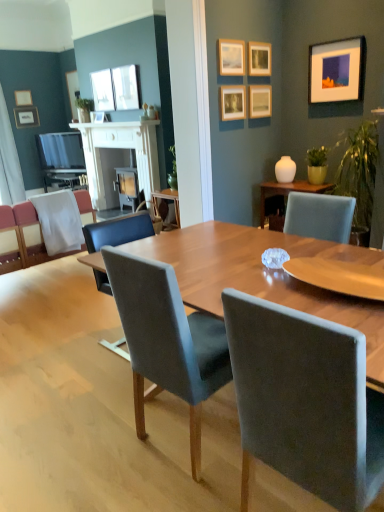
Question: From the image's perspective, is matte white picture frame at upper left, which ranks as the ninth picture frame in front-to-back order, located beneath matte silver picture frame at upper left, which is the 10th picture frame in front-to-back order?

Choices:
 (A) no
 (B) yes

Answer: (A)

Question: Is matte white picture frame at upper left, which is the 3th picture frame from left to right, positioned with its back to matte silver picture frame at upper left, the 2th picture frame in the left-to-right sequence?

Choices:
 (A) yes
 (B) no

Answer: (B)

Question: Is matte white picture frame at upper left, which ranks as the ninth picture frame in front-to-back order, touching matte silver picture frame at upper left, the first picture frame in the back-to-front sequence?

Choices:
 (A) no
 (B) yes

Answer: (A)

Question: Would you consider matte white picture frame at upper left, which is the 3th picture frame from left to right, to be distant from matte silver picture frame at upper left, placed as the ninth picture frame when sorted from right to left?

Choices:
 (A) no
 (B) yes

Answer: (A)

Question: Does matte white picture frame at upper left, which ranks as the ninth picture frame in front-to-back order, appear on the right side of matte silver picture frame at upper left, the first picture frame in the back-to-front sequence?

Choices:
 (A) yes
 (B) no

Answer: (A)

Question: Is matte white picture frame at upper left, which is the 3th picture frame from left to right, located outside matte silver picture frame at upper left, the first picture frame in the back-to-front sequence?

Choices:
 (A) no
 (B) yes

Answer: (B)

Question: Considering the relative sizes of white fabric curtain at left and green matte plant at right, the second houseplant from the top, in the image provided, is white fabric curtain at left wider than green matte plant at right, the second houseplant from the top,?

Choices:
 (A) no
 (B) yes

Answer: (B)

Question: Is white fabric curtain at left shorter than green matte plant at right, the second houseplant viewed from the back?

Choices:
 (A) yes
 (B) no

Answer: (B)

Question: Would you say white fabric curtain at left is outside green matte plant at right, the second houseplant viewed from the left?

Choices:
 (A) yes
 (B) no

Answer: (A)

Question: Is white fabric curtain at left thinner than green matte plant at right, the first houseplant ordered from the bottom?

Choices:
 (A) no
 (B) yes

Answer: (A)

Question: From the image's perspective, is white fabric curtain at left located above green matte plant at right, the second houseplant viewed from the back?

Choices:
 (A) yes
 (B) no

Answer: (A)

Question: Is white fabric curtain at left taller than green matte plant at right, the first houseplant positioned from the right?

Choices:
 (A) yes
 (B) no

Answer: (A)

Question: Can you confirm if white fabric curtain at left is positioned to the right of white glossy vase at upper right?

Choices:
 (A) no
 (B) yes

Answer: (A)